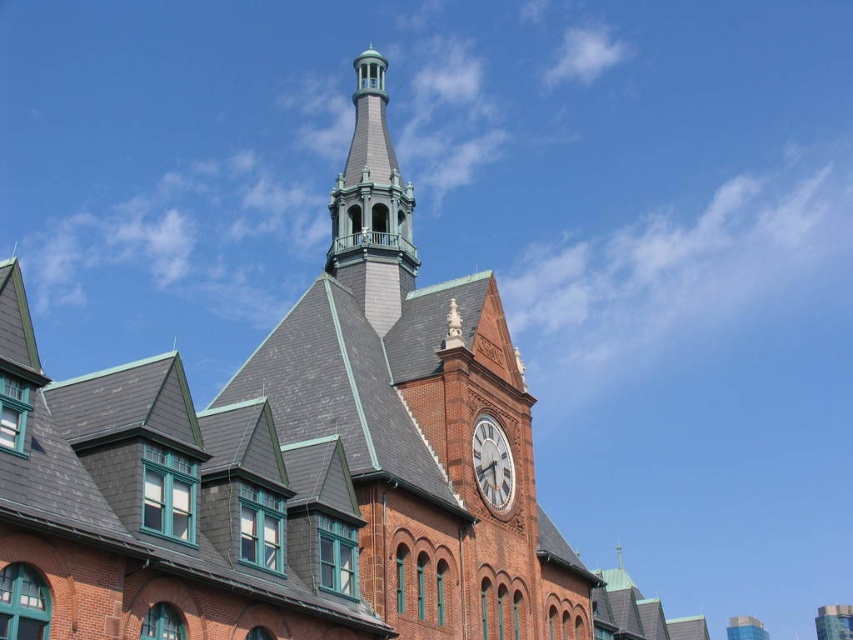
You are standing at the base of the building and want to locate the green copper bell tower at upper center. According to the coordinates provided, where should you look?

The green copper bell tower at upper center is located at coordinates point [372,205].